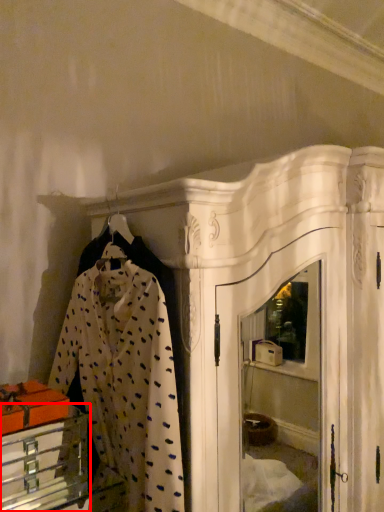
Question: In this image, where is furniture (annotated by the red box) located relative to clothing?

Choices:
 (A) right
 (B) left

Answer: (B)